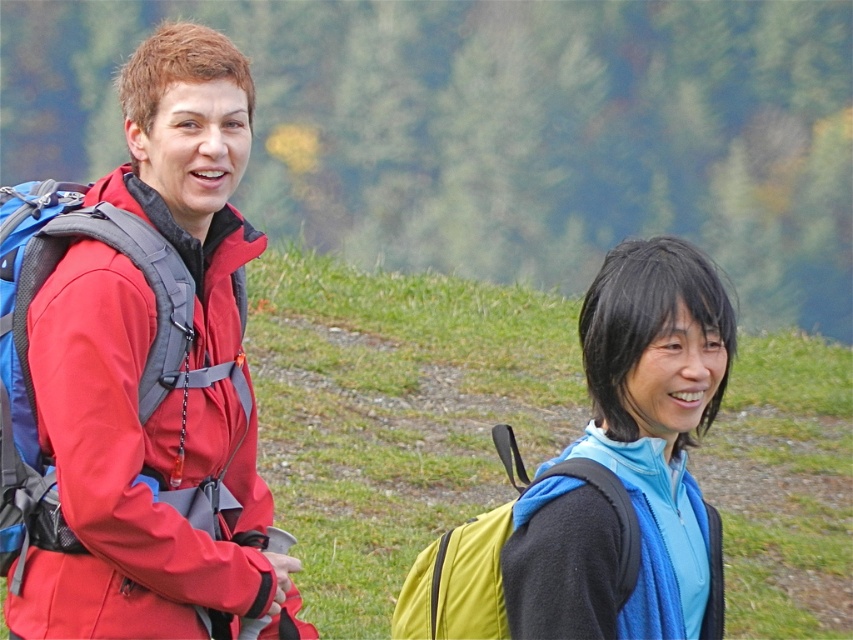
Question: Which of the following is the farthest from the observer?

Choices:
 (A) blue fleece jacket at right
 (B) yellow fabric backpack at lower right
 (C) matte red jacket at left

Answer: (C)

Question: Considering the real-world distances, which object is closest to the matte red jacket at left?

Choices:
 (A) yellow fabric backpack at lower right
 (B) blue fleece jacket at right

Answer: (A)

Question: Which object is the farthest from the yellow fabric backpack at lower right?

Choices:
 (A) blue fleece jacket at right
 (B) matte red jacket at left

Answer: (B)

Question: Can you confirm if matte red jacket at left is wider than yellow fabric backpack at lower right?

Choices:
 (A) yes
 (B) no

Answer: (B)

Question: Can you confirm if matte red jacket at left is positioned below yellow fabric backpack at lower right?

Choices:
 (A) yes
 (B) no

Answer: (B)

Question: Can you confirm if matte red jacket at left is wider than blue fleece jacket at right?

Choices:
 (A) no
 (B) yes

Answer: (B)